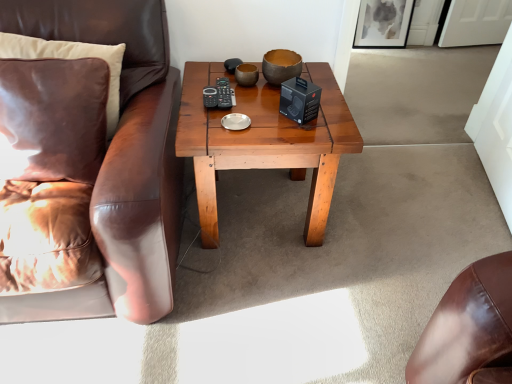
Locate an element on the screen. vacant space in front of matte brown bowl at center is located at coordinates (276, 109).